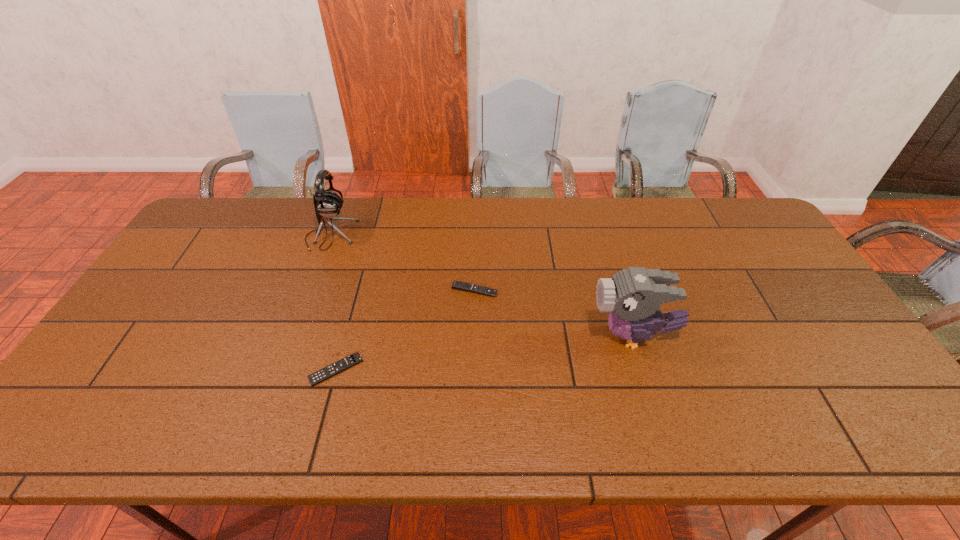
Point out which object is positioned as the second nearest to the rightmost object. Please provide its 2D coordinates. Your answer should be formatted as a tuple, i.e. [(x, y)], where the tuple contains the x and y coordinates of a point satisfying the conditions above.

[(331, 370)]

Where is `vacant space that satisfies the following two spatial constraints: 1. on the front side of the earphone; 2. on the left side of the farther remote control`? vacant space that satisfies the following two spatial constraints: 1. on the front side of the earphone; 2. on the left side of the farther remote control is located at coordinates (310, 290).

The image size is (960, 540). Find the location of `free point that satisfies the following two spatial constraints: 1. on the front side of the nearest object; 2. on the left side of the earphone`. free point that satisfies the following two spatial constraints: 1. on the front side of the nearest object; 2. on the left side of the earphone is located at coordinates (280, 369).